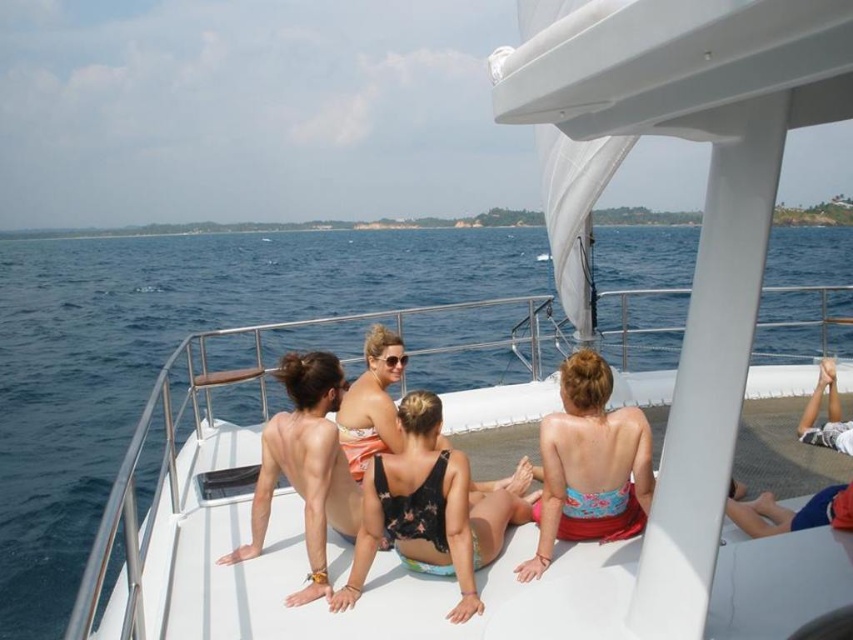
What is the 2D coordinate of the blue water at center?

The blue water at center is located at the 2D coordinate point of (167, 355).

You are navigating a drone to take aerial photos of the boat. The drone must hover exactly above the blue water at center. What coordinates should the drone aim for?

The drone should aim for the coordinates point at (x=167, y=355) to hover exactly above the blue water at center.

You are a photographer on the boat and want to take a photo of the blue water at center and the blue floral bikini top at center. Which one is more to the left in the frame?

The blue water at center is positioned on the left side of the blue floral bikini top at center, so it is more to the left in the frame.